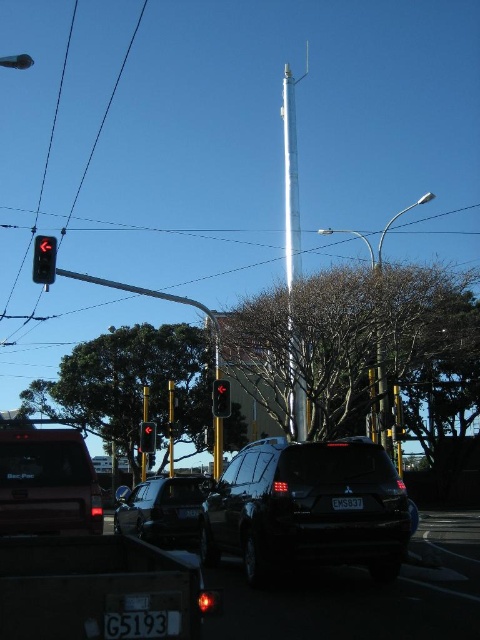
Does red glass traffic light at center have a lesser width compared to metallic streetlight at center?

Indeed, red glass traffic light at center has a lesser width compared to metallic streetlight at center.

Does red glass traffic light at center have a greater height compared to metallic streetlight at center?

No, red glass traffic light at center is not taller than metallic streetlight at center.

Between point (146, 451) and point (373, 268), which one is positioned in front?

Point (373, 268)

At what (x,y) coordinates should I click in order to perform the action: click on red glass traffic light at center. Please return your answer as a coordinate pair (x, y). Looking at the image, I should click on (147, 436).

Is dark gray metallic suv at center above matte black traffic light at center?

Actually, dark gray metallic suv at center is below matte black traffic light at center.

Between dark gray metallic suv at center and matte black traffic light at center, which one appears on the left side from the viewer's perspective?

Positioned to the left is dark gray metallic suv at center.

Does point (172, 481) come farther from viewer compared to point (214, 394)?

No, it is not.

In order to click on dark gray metallic suv at center in this screenshot , I will do `click(163, 509)`.

Is matte black traffic light at left further to the viewer compared to metallic streetlight at center?

No, matte black traffic light at left is in front of metallic streetlight at center.

Is matte black traffic light at left positioned in front of metallic streetlight at center?

Yes, it is.

What do you see at coordinates (44, 259) in the screenshot? This screenshot has width=480, height=640. I see `matte black traffic light at left` at bounding box center [44, 259].

This screenshot has width=480, height=640. What are the coordinates of `matte black traffic light at left` in the screenshot? It's located at (44, 259).